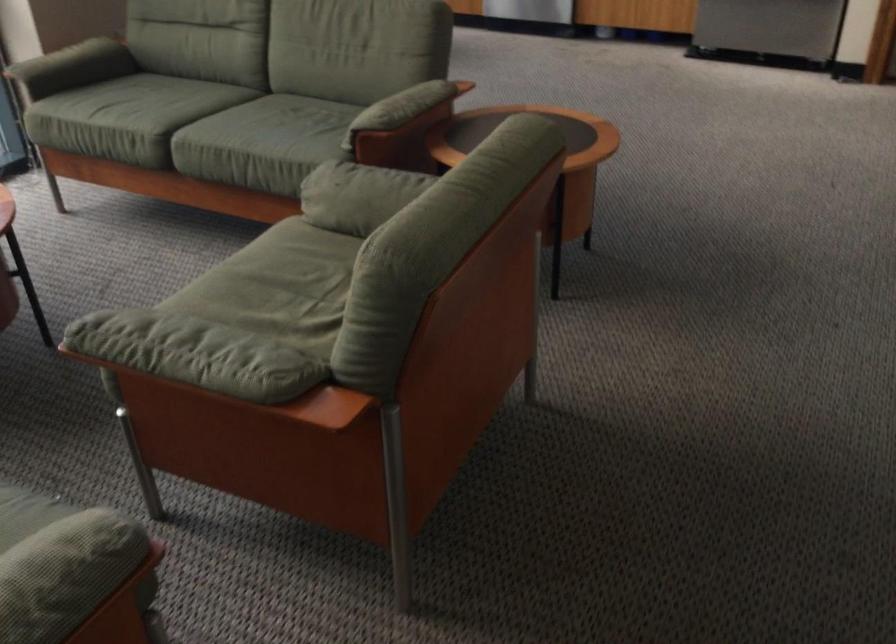
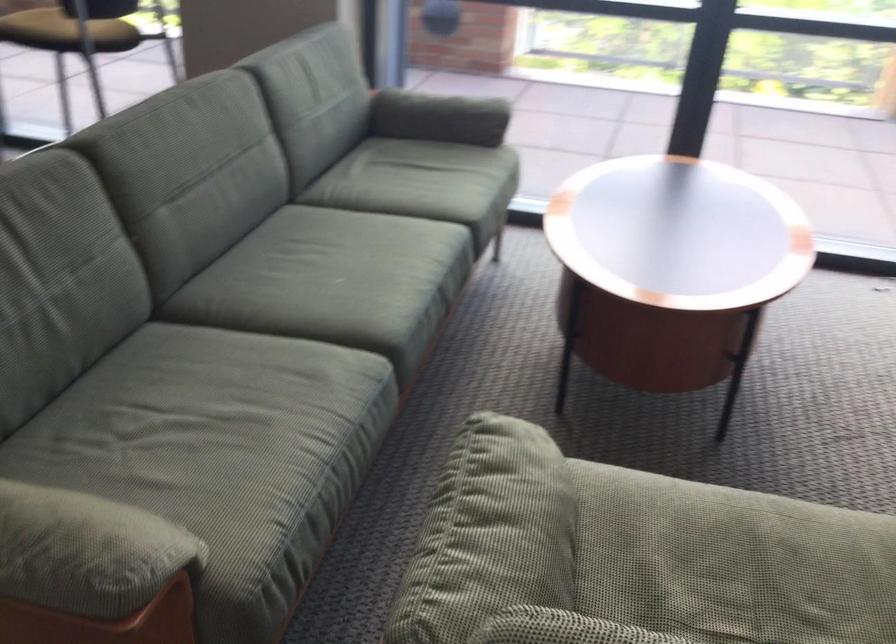
In the second image, find the point that corresponds to point 264,303 in the first image.

(702, 582)